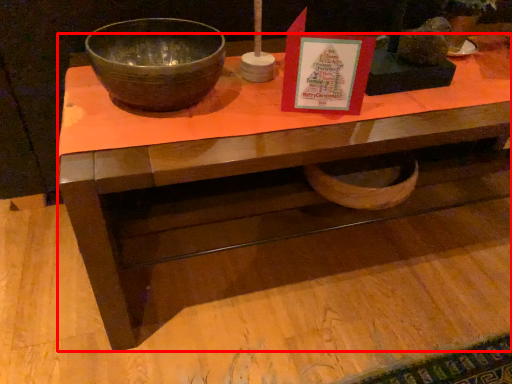
Question: Considering the relative positions of desk (annotated by the red box) and bowl in the image provided, where is desk (annotated by the red box) located with respect to the staircase?

Choices:
 (A) right
 (B) left

Answer: (A)